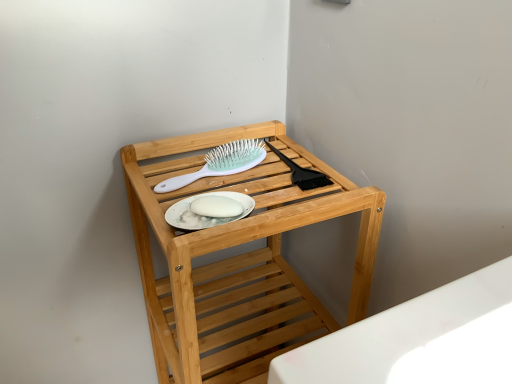
Where is `free space in front of white plastic hairbrush at upper center`? free space in front of white plastic hairbrush at upper center is located at coordinates (208, 208).